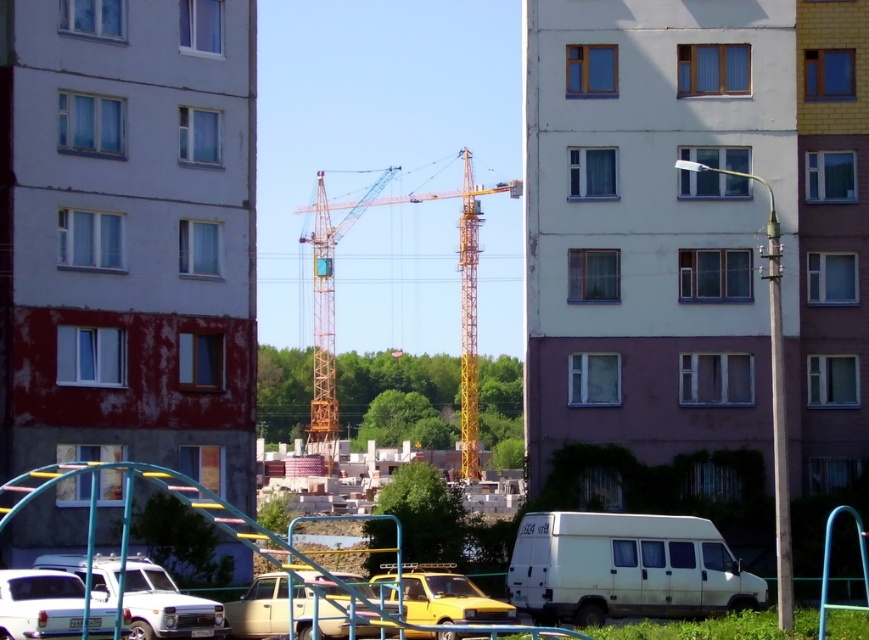
You are a delivery driver who needs to park your white glossy car at lower left near the yellow metallic crane at center. Based on the scene, can you safely maneuver your car to the crane without crossing any obstacles?

The yellow metallic crane at center is to the right of the white glossy car at lower left, so you can safely maneuver your car to the crane as there are no obstacles mentioned between them in the scene description.

You are a delivery driver who needs to park your white glossy car at lower left near the yellow metallic crane at center. Considering the height of the crane, will your car fit under it without any damage?

The yellow metallic crane at center is taller than the white glossy car at lower left, so the car should fit under it without any damage as long as there is enough clearance. However, it is always advisable to check the exact measurements for safety.